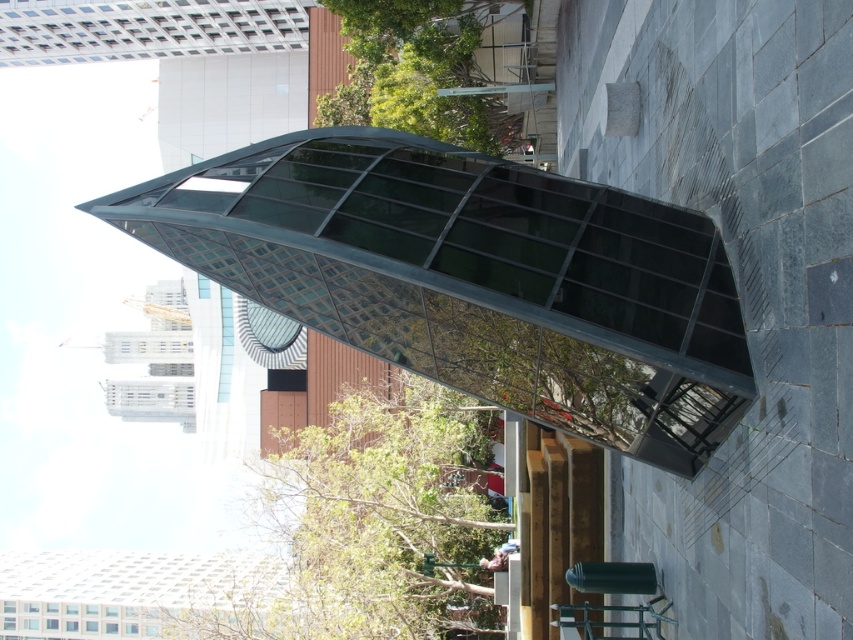
Question: Can you confirm if transparent glass canopy at center is wider than metallic silver chair at lower center?

Choices:
 (A) no
 (B) yes

Answer: (B)

Question: Is transparent glass canopy at center to the right of metallic silver chair at lower center from the viewer's perspective?

Choices:
 (A) no
 (B) yes

Answer: (A)

Question: Which point is closer to the camera taking this photo?

Choices:
 (A) (583, 627)
 (B) (643, 253)

Answer: (B)

Question: Can you confirm if transparent glass canopy at center is wider than metallic silver chair at lower center?

Choices:
 (A) yes
 (B) no

Answer: (A)

Question: Which of the following is the closest to the observer?

Choices:
 (A) transparent glass canopy at center
 (B) metallic silver chair at lower center

Answer: (A)